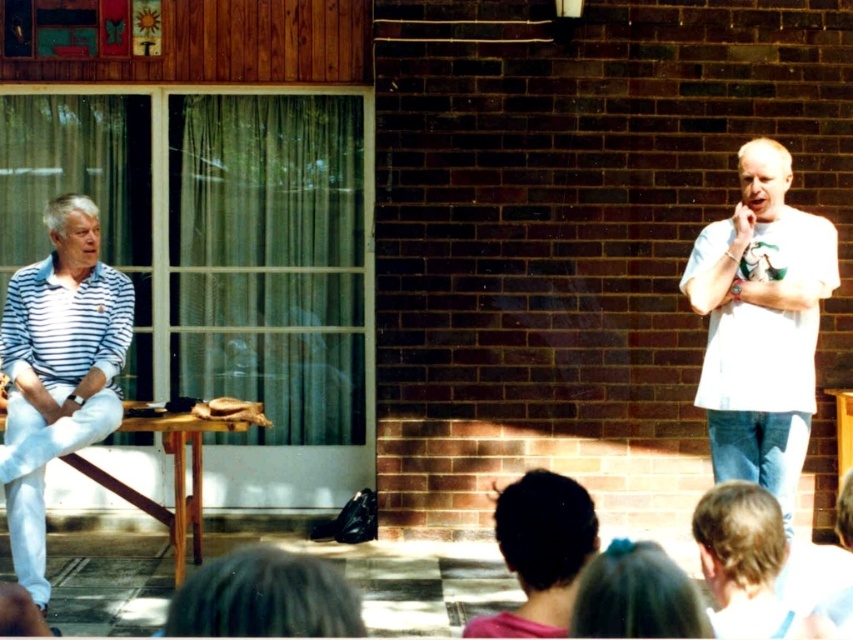
Is white cotton shirt at right bigger than white striped polo shirt at left?

No.

Which is more to the left, white cotton shirt at right or white striped polo shirt at left?

Positioned to the left is white striped polo shirt at left.

Image resolution: width=853 pixels, height=640 pixels. What do you see at coordinates (759, 324) in the screenshot?
I see `white cotton shirt at right` at bounding box center [759, 324].

This screenshot has height=640, width=853. What are the coordinates of `white cotton shirt at right` in the screenshot? It's located at (759, 324).